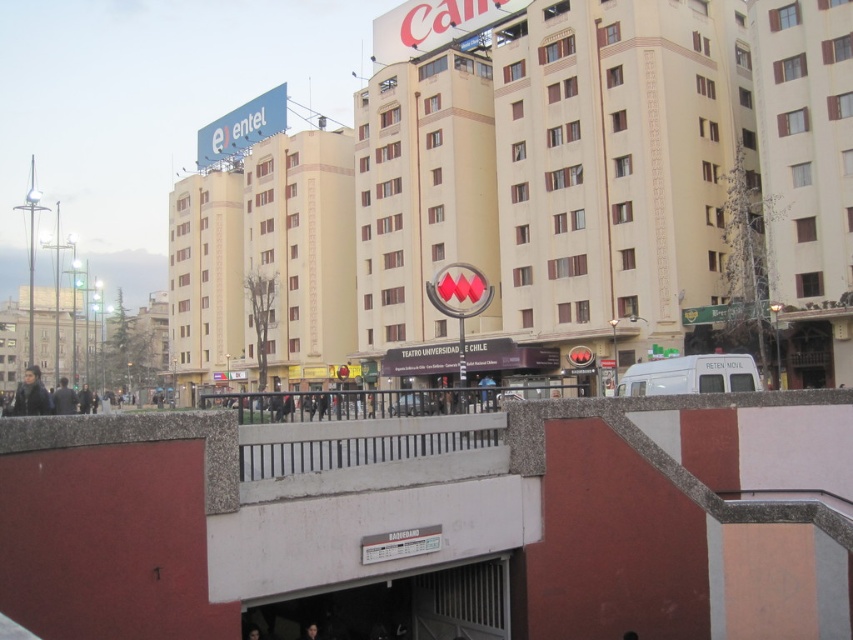
Looking at this image, does beige concrete building at center appear on the right side of dark brown leather jacket at lower left?

Correct, you'll find beige concrete building at center to the right of dark brown leather jacket at lower left.

Is beige concrete building at center positioned at the back of dark brown leather jacket at lower left?

No.

Who is more distant from viewer, (601, 154) or (38, 387)?

The point (601, 154) is more distant.

Find the location of a particular element. beige concrete building at center is located at coordinates (543, 202).

Does beige concrete building at center have a smaller size compared to dark hair at lower center?

Actually, beige concrete building at center might be larger than dark hair at lower center.

Is beige concrete building at center below dark hair at lower center?

Incorrect, beige concrete building at center is not positioned below dark hair at lower center.

Who is more forward, (x=419, y=74) or (x=311, y=630)?

Point (x=311, y=630) is more forward.

Image resolution: width=853 pixels, height=640 pixels. What are the coordinates of `beige concrete building at center` in the screenshot? It's located at (543, 202).

Can you confirm if dark brown leather jacket at lower left is positioned above dark gray jacket at left?

Correct, dark brown leather jacket at lower left is located above dark gray jacket at left.

Is dark brown leather jacket at lower left further to camera compared to dark gray jacket at left?

No.

Measure the distance between dark brown leather jacket at lower left and camera.

They are 47.07 meters apart.

The height and width of the screenshot is (640, 853). Find the location of `dark brown leather jacket at lower left`. dark brown leather jacket at lower left is located at coordinates (32, 394).